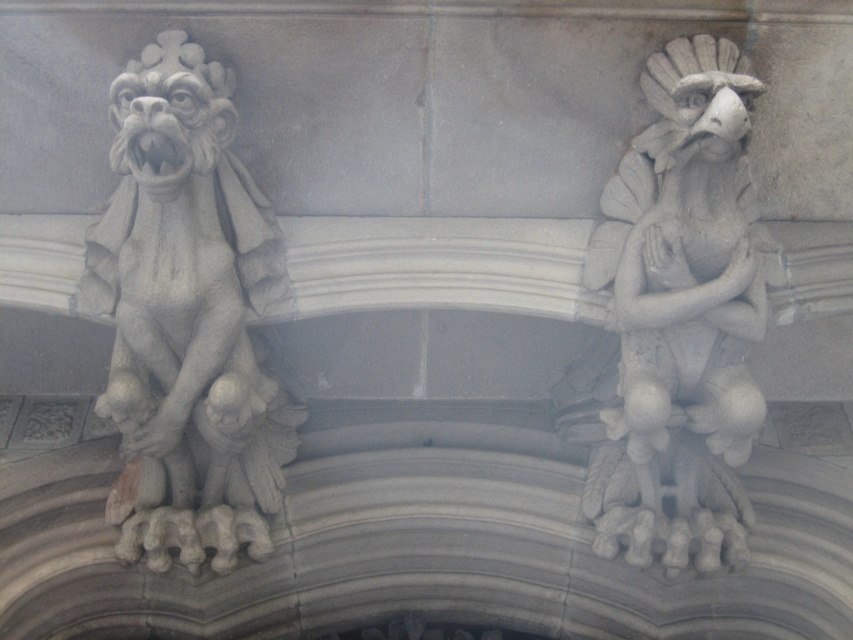
Question: Can you confirm if gray stone gargoyle at left is positioned to the right of white stone gargoyle at right?

Choices:
 (A) no
 (B) yes

Answer: (A)

Question: Does gray stone gargoyle at left come in front of white stone gargoyle at right?

Choices:
 (A) yes
 (B) no

Answer: (A)

Question: Can you confirm if gray stone gargoyle at left is positioned to the right of white stone gargoyle at right?

Choices:
 (A) no
 (B) yes

Answer: (A)